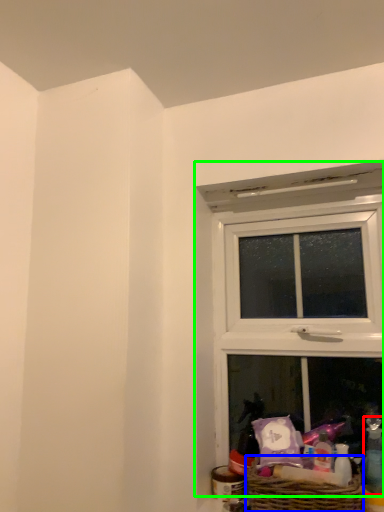
Question: Estimate the real-world distances between objects in this image. Which object is farther from toiletry (highlighted by a red box), picnic basket (highlighted by a blue box) or window (highlighted by a green box)?

Choices:
 (A) picnic basket
 (B) window

Answer: (B)